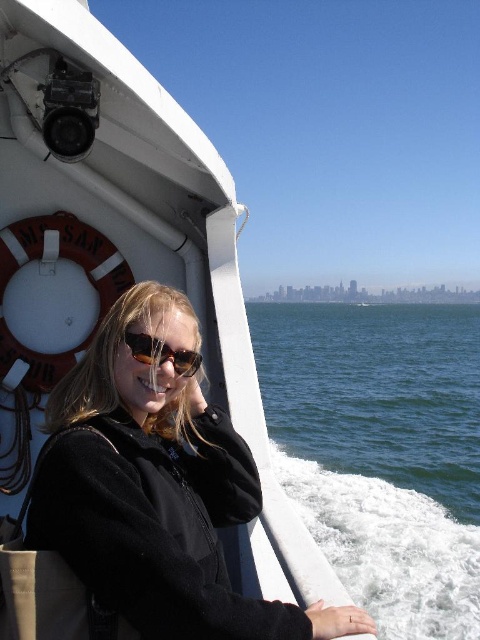
You are standing on the deck of the MS San Francisco boat and see the blue water at lower right and the matte black sunglasses at center. Which object takes up more space in your view?

The blue water at lower right takes up more space in your view because it is larger in size than the matte black sunglasses at center.

You are a passenger on the MS San Francisco boat and want to take a photo of the blue water at lower right while holding your matte black sunglasses at center. Can you hold your sunglasses in a way that they won not block the view of the water in the photo?

The blue water at lower right is further to the viewer than matte black sunglasses at center, so if you hold your matte black sunglasses at center closer to the camera, they will block the view of the blue water at lower right in the photo.